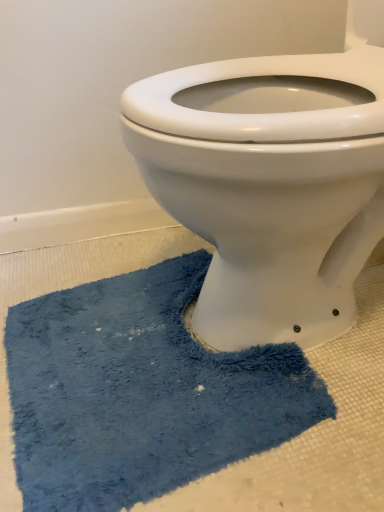
Question: Is white glossy porcelain toilet at center beside blue fuzzy bath mat at lower center?

Choices:
 (A) yes
 (B) no

Answer: (B)

Question: Is the depth of white glossy porcelain toilet at center greater than that of blue fuzzy bath mat at lower center?

Choices:
 (A) yes
 (B) no

Answer: (B)

Question: From a real-world perspective, is white glossy porcelain toilet at center below blue fuzzy bath mat at lower center?

Choices:
 (A) yes
 (B) no

Answer: (B)

Question: Considering the relative sizes of white glossy porcelain toilet at center and blue fuzzy bath mat at lower center in the image provided, is white glossy porcelain toilet at center thinner than blue fuzzy bath mat at lower center?

Choices:
 (A) yes
 (B) no

Answer: (B)

Question: From the image's perspective, is white glossy porcelain toilet at center on blue fuzzy bath mat at lower center?

Choices:
 (A) yes
 (B) no

Answer: (A)

Question: Is white glossy porcelain toilet at center closer to the viewer compared to blue fuzzy bath mat at lower center?

Choices:
 (A) no
 (B) yes

Answer: (B)

Question: Can you confirm if blue fuzzy bath mat at lower center is smaller than white glossy porcelain toilet at center?

Choices:
 (A) yes
 (B) no

Answer: (A)

Question: From a real-world perspective, does blue fuzzy bath mat at lower center sit lower than white glossy porcelain toilet at center?

Choices:
 (A) no
 (B) yes

Answer: (B)

Question: Is white glossy porcelain toilet at center a part of blue fuzzy bath mat at lower center?

Choices:
 (A) no
 (B) yes

Answer: (A)

Question: From the image's perspective, is blue fuzzy bath mat at lower center under white glossy porcelain toilet at center?

Choices:
 (A) yes
 (B) no

Answer: (A)

Question: Is blue fuzzy bath mat at lower center thinner than white glossy porcelain toilet at center?

Choices:
 (A) yes
 (B) no

Answer: (A)

Question: Is there a large distance between blue fuzzy bath mat at lower center and white glossy porcelain toilet at center?

Choices:
 (A) yes
 (B) no

Answer: (B)

Question: In terms of size, does blue fuzzy bath mat at lower center appear bigger or smaller than white glossy porcelain toilet at center?

Choices:
 (A) small
 (B) big

Answer: (A)